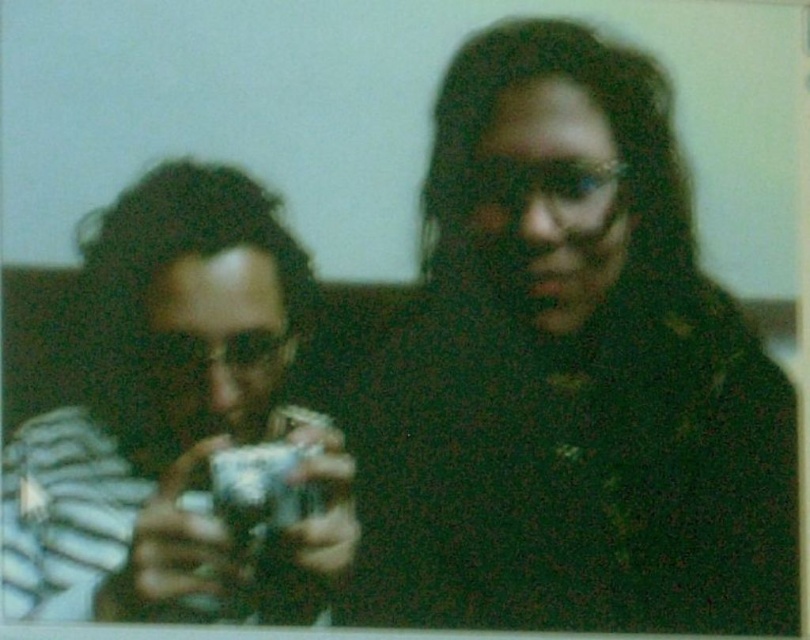
You are a photographer trying to capture a candid shot of two people sitting next to each other. You notice the metallic silver camera at left and the black matte sweater at center in the scene. Based on their positions, which object is closer to the left side of the image?

The metallic silver camera at left is closer to the left side of the image since it is positioned to the left of the black matte sweater at center.

You are trying to decide which item to place in a display case that requires items to be at least 10 inches tall. You have the black matte sweater at center and the metallic silver camera at left. Based on their sizes, which item would qualify for the display case?

The black matte sweater at center is taller than the metallic silver camera at left, so it would qualify for the display case requiring items to be at least 10 inches tall.